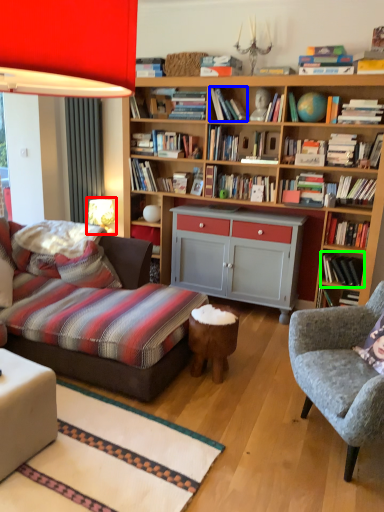
Question: Which object is positioned farthest from table lamp (highlighted by a red box)? Select from book (highlighted by a blue box) and book (highlighted by a green box).

Choices:
 (A) book
 (B) book

Answer: (B)